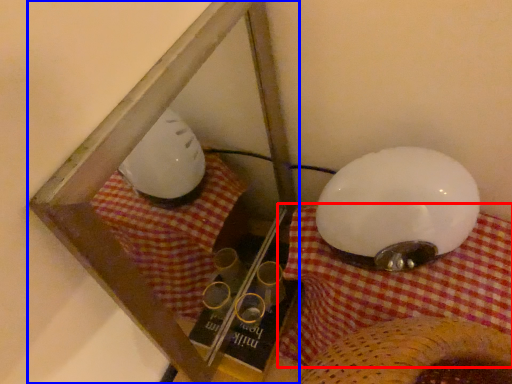
Question: Which object appears closest to the camera in this image, blanket (highlighted by a red box) or glass box (highlighted by a blue box)?

Choices:
 (A) blanket
 (B) glass box

Answer: (A)